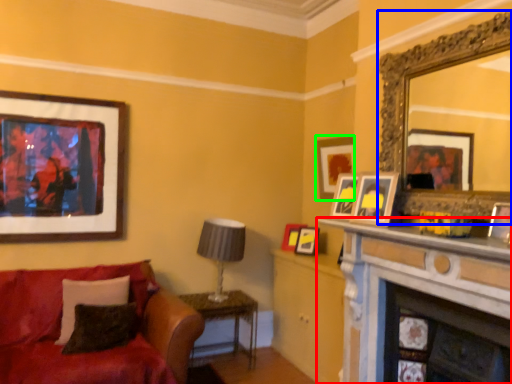
Question: Which object is the closest to the fireplace (highlighted by a red box)? Choose among these: mirror (highlighted by a blue box) or picture frame (highlighted by a green box).

Choices:
 (A) mirror
 (B) picture frame

Answer: (A)